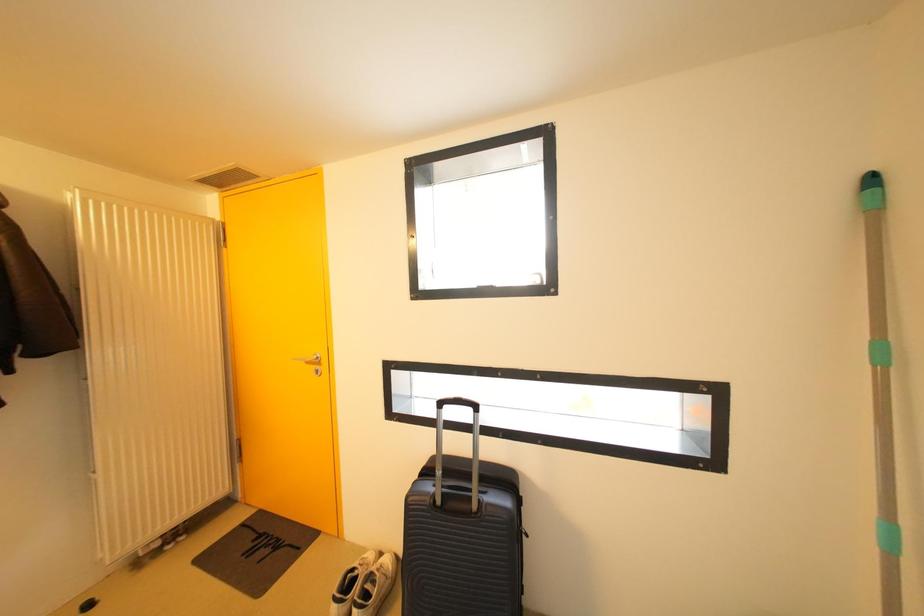
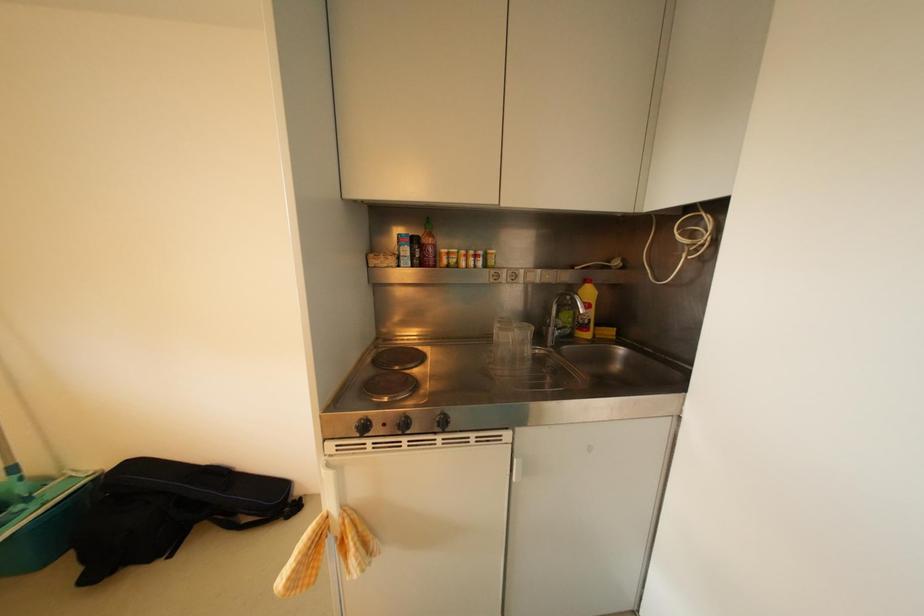
Question: The camera is either moving clockwise (left) or counter-clockwise (right) around the object. The first image is from the beginning of the video and the second image is from the end. Is the camera moving left or right when shooting the video?

Choices:
 (A) Left
 (B) Right

Answer: (A)